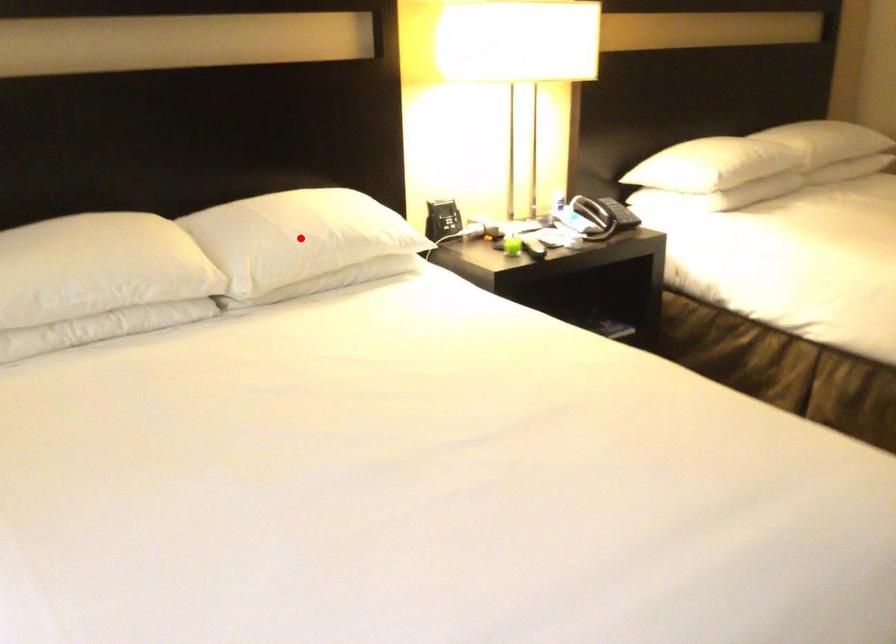
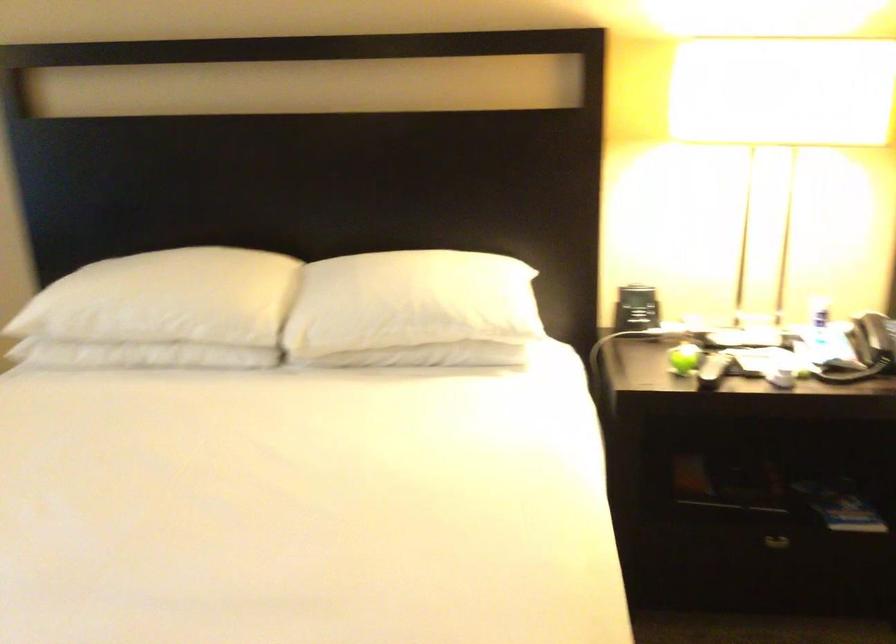
Question: I am providing you with two images of the same scene from different viewpoints. A red point is marked on the first image. Can you still see the location of the red point in image 2?

Choices:
 (A) Yes
 (B) No

Answer: (A)